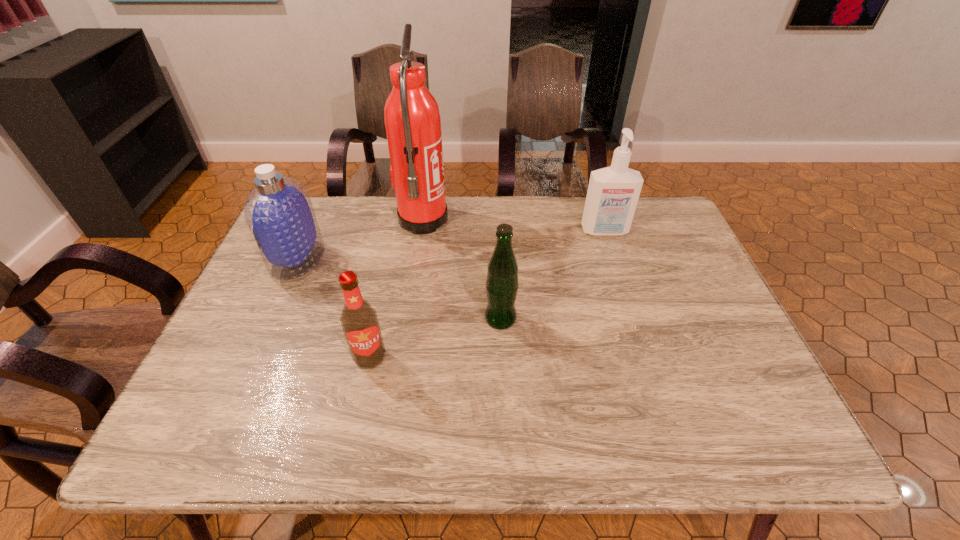
This screenshot has height=540, width=960. I want to click on the tallest object, so click(412, 119).

Find the location of `the rightmost object`. the rightmost object is located at coordinates (613, 192).

Where is `the left cleansing agent`? the left cleansing agent is located at coordinates (279, 213).

This screenshot has width=960, height=540. I want to click on the farther beer bottle, so click(x=502, y=285).

The image size is (960, 540). I want to click on the right beer bottle, so click(x=502, y=285).

Find the location of a particular element. the nearest object is located at coordinates (359, 320).

You are a GUI agent. You are given a task and a screenshot of the screen. Output one action in this format:
    pyautogui.click(x=<x>, y=<y>)
    Task: Click on the left beer bottle
    The width and height of the screenshot is (960, 540).
    Given the screenshot: What is the action you would take?
    pyautogui.click(x=359, y=320)

Find the location of a particular element. vacant space located on the label side of the tallest object is located at coordinates (499, 221).

Locate an element on the screen. vacant area located on the front label of the right cleansing agent is located at coordinates (627, 300).

At what (x,y) coordinates should I click in order to perform the action: click on vacant space located on the right of the left cleansing agent. Please return your answer as a coordinate pair (x, y). This screenshot has height=540, width=960. Looking at the image, I should click on [x=463, y=260].